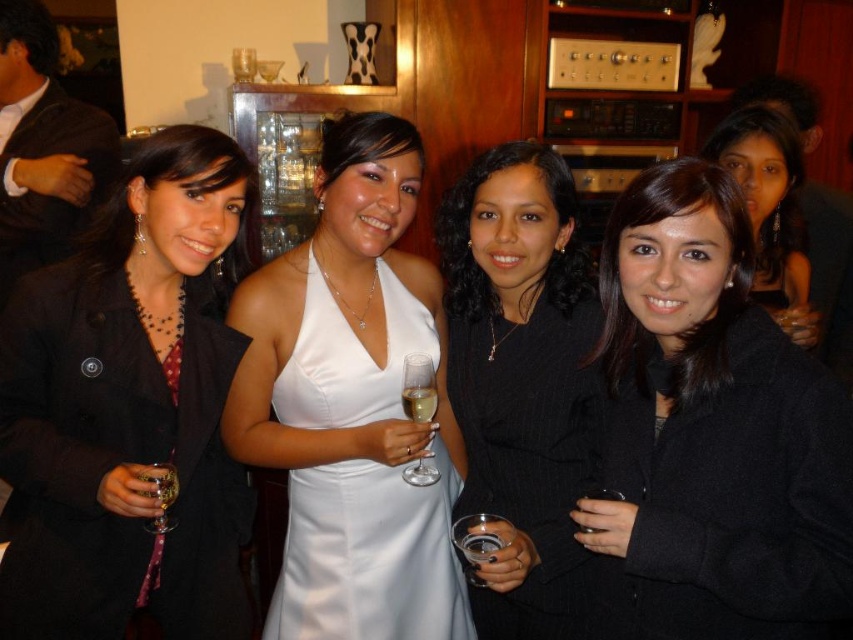
Between matte black coat at left and clear glass wine glass at lower right, which one is positioned lower?

clear glass wine glass at lower right is below.

Measure the distance between matte black coat at left and camera.

4.04 feet

At what (x,y) coordinates should I click in order to perform the action: click on matte black coat at left. Please return your answer as a coordinate pair (x, y). Looking at the image, I should click on (129, 410).

Is point (786, 200) more distant than point (593, 493)?

That is True.

Measure the distance between black wool coat at lower right and clear glass wine glass at lower right.

black wool coat at lower right is 38.10 inches from clear glass wine glass at lower right.

Is point (766, 244) farther from camera compared to point (593, 486)?

Yes, point (766, 244) is behind point (593, 486).

The height and width of the screenshot is (640, 853). What are the coordinates of `black wool coat at lower right` in the screenshot? It's located at (770, 209).

Does clear glass wine glass at center appear on the right side of clear glass champagne at center?

Yes, clear glass wine glass at center is to the right of clear glass champagne at center.

Does clear glass wine glass at center have a greater height compared to clear glass champagne at center?

Yes.

The width and height of the screenshot is (853, 640). Describe the element at coordinates (419, 388) in the screenshot. I see `clear glass wine glass at center` at that location.

This screenshot has width=853, height=640. Identify the location of clear glass wine glass at center. (419, 388).